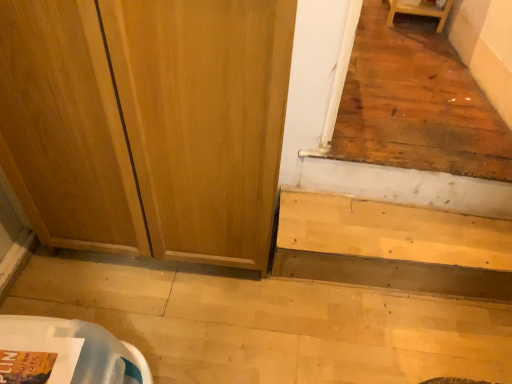
Question: Is the position of light wood/stained stairs at lower right more distant than that of wooden screen door at center?

Choices:
 (A) no
 (B) yes

Answer: (B)

Question: Can you confirm if light wood/stained stairs at lower right is wider than wooden screen door at center?

Choices:
 (A) no
 (B) yes

Answer: (A)

Question: Is light wood/stained stairs at lower right with wooden screen door at center?

Choices:
 (A) yes
 (B) no

Answer: (B)

Question: Are light wood/stained stairs at lower right and wooden screen door at center far apart?

Choices:
 (A) yes
 (B) no

Answer: (B)

Question: Does light wood/stained stairs at lower right appear on the left side of wooden screen door at center?

Choices:
 (A) no
 (B) yes

Answer: (A)

Question: Is light wood/stained stairs at lower right positioned before wooden screen door at center?

Choices:
 (A) yes
 (B) no

Answer: (B)

Question: Considering the relative sizes of wooden screen door at center and light wood/stained stairs at lower right in the image provided, is wooden screen door at center wider than light wood/stained stairs at lower right?

Choices:
 (A) yes
 (B) no

Answer: (A)

Question: Is wooden screen door at center oriented away from light wood/stained stairs at lower right?

Choices:
 (A) no
 (B) yes

Answer: (A)

Question: Does wooden screen door at center appear on the right side of light wood/stained stairs at lower right?

Choices:
 (A) yes
 (B) no

Answer: (B)

Question: From the image's perspective, is wooden screen door at center on light wood/stained stairs at lower right?

Choices:
 (A) yes
 (B) no

Answer: (A)

Question: Is wooden screen door at center to the left of light wood/stained stairs at lower right from the viewer's perspective?

Choices:
 (A) no
 (B) yes

Answer: (B)

Question: Would you say wooden screen door at center is a long distance from light wood/stained stairs at lower right?

Choices:
 (A) no
 (B) yes

Answer: (A)

Question: From their relative heights in the image, would you say wooden screen door at center is taller or shorter than light wood/stained stairs at lower right?

Choices:
 (A) tall
 (B) short

Answer: (A)